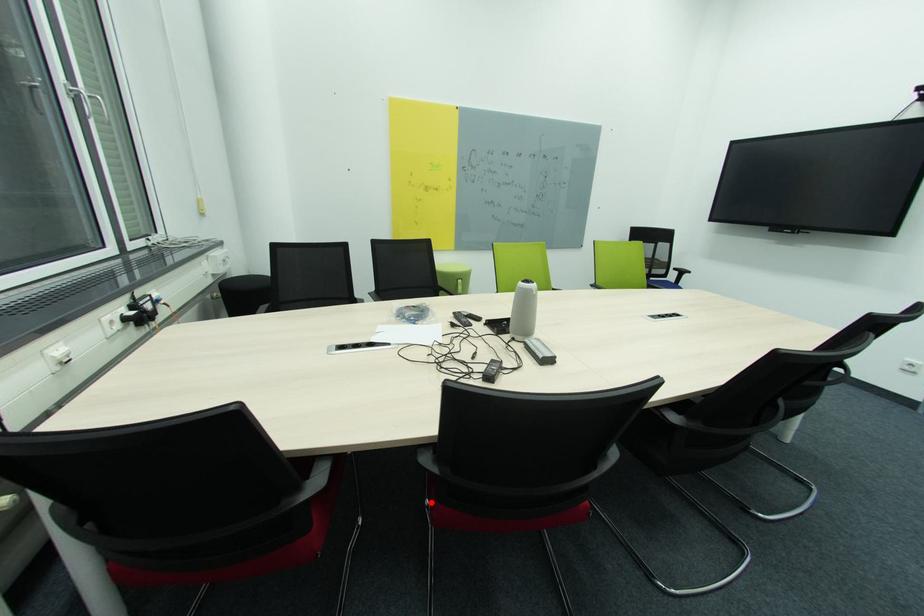
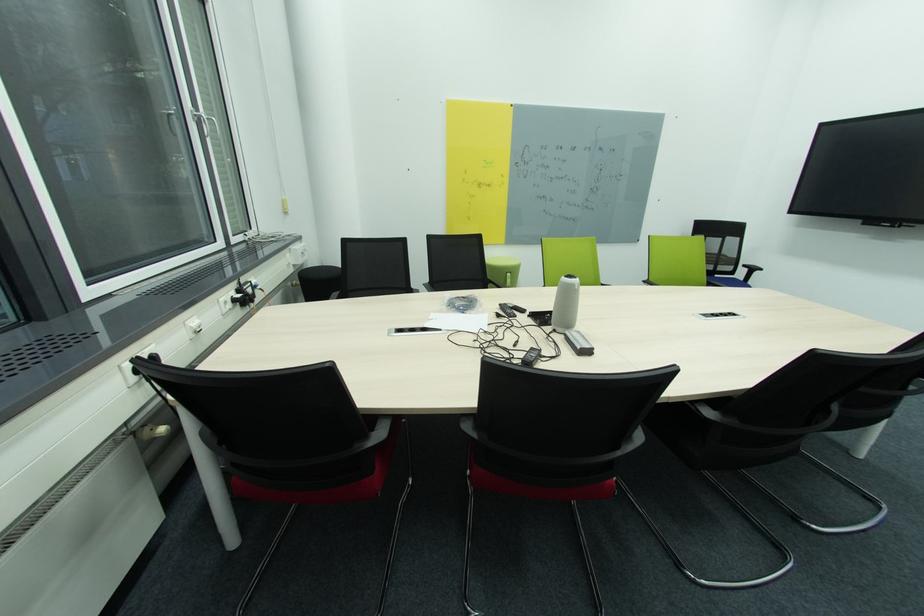
Question: I am providing you with two images of the same scene from different viewpoints. A red point is marked on the first image. At the location where the point appears in image 1, is it still visible in image 2?

Choices:
 (A) Yes
 (B) No

Answer: (A)